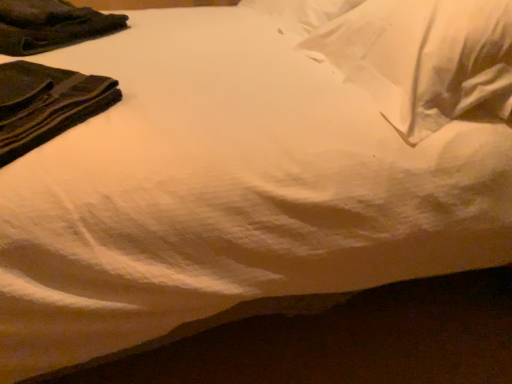
Identify the location of dark green fabric at upper left, the 1th clothing in the bottom-to-top sequence. (46, 104).

What do you see at coordinates (51, 25) in the screenshot? The height and width of the screenshot is (384, 512). I see `dark green fabric at upper left, the 1th clothing in the top-to-bottom sequence` at bounding box center [51, 25].

The width and height of the screenshot is (512, 384). Identify the location of white soft pillow at upper right. (425, 59).

Measure the distance between white soft pillow at upper right and camera.

36.93 inches.

This screenshot has width=512, height=384. Identify the location of dark green fabric at upper left, the 1th clothing in the bottom-to-top sequence. (46, 104).

From the picture: Is dark green fabric at upper left, the 2th clothing in the back-to-front sequence, smaller than dark green fabric at upper left, arranged as the second clothing when ordered from the bottom?

Indeed, dark green fabric at upper left, the 2th clothing in the back-to-front sequence, has a smaller size compared to dark green fabric at upper left, arranged as the second clothing when ordered from the bottom.

Does dark green fabric at upper left, the 1th clothing in the bottom-to-top sequence, have a greater width compared to dark green fabric at upper left, acting as the 2th clothing starting from the front?

In fact, dark green fabric at upper left, the 1th clothing in the bottom-to-top sequence, might be narrower than dark green fabric at upper left, acting as the 2th clothing starting from the front.

Between point (44, 127) and point (1, 46), which one is positioned behind?

The point (1, 46) is behind.

Is dark green fabric at upper left, the 2th clothing in the back-to-front sequence, positioned behind dark green fabric at upper left, acting as the 2th clothing starting from the front?

That is False.

Who is more distant, dark green fabric at upper left, the 1th clothing in the bottom-to-top sequence, or white soft pillow at upper right?

white soft pillow at upper right is further from the camera.

From a real-world perspective, relative to white soft pillow at upper right, is dark green fabric at upper left, the 2th clothing in the back-to-front sequence, vertically above or below?

dark green fabric at upper left, the 2th clothing in the back-to-front sequence, is situated lower than white soft pillow at upper right in the real world.

Considering the sizes of objects dark green fabric at upper left, the 2th clothing in the back-to-front sequence, and white soft pillow at upper right in the image provided, who is bigger, dark green fabric at upper left, the 2th clothing in the back-to-front sequence, or white soft pillow at upper right?

With larger size is white soft pillow at upper right.

Considering the sizes of objects dark green fabric at upper left, the 2th clothing in the back-to-front sequence, and white soft pillow at upper right in the image provided, who is thinner, dark green fabric at upper left, the 2th clothing in the back-to-front sequence, or white soft pillow at upper right?

dark green fabric at upper left, the 2th clothing in the back-to-front sequence.

Measure the distance between white soft pillow at upper right and dark green fabric at upper left, the 2th clothing in the back-to-front sequence.

white soft pillow at upper right is 29.86 inches away from dark green fabric at upper left, the 2th clothing in the back-to-front sequence.

From a real-world perspective, relative to dark green fabric at upper left, positioned as the first clothing in front-to-back order, is white soft pillow at upper right vertically above or below?

From a real-world perspective, white soft pillow at upper right is physically above dark green fabric at upper left, positioned as the first clothing in front-to-back order.

From the image's perspective, is white soft pillow at upper right located above or below dark green fabric at upper left, positioned as the 2th clothing in top-to-bottom order?

From the image's perspective, white soft pillow at upper right appears above dark green fabric at upper left, positioned as the 2th clothing in top-to-bottom order.

Is there a large distance between white soft pillow at upper right and dark green fabric at upper left, the 1th clothing in the bottom-to-top sequence?

No, white soft pillow at upper right is not far from dark green fabric at upper left, the 1th clothing in the bottom-to-top sequence.

Is white soft pillow at upper right a part of dark green fabric at upper left, the first clothing from the back?

That's incorrect, white soft pillow at upper right is not inside dark green fabric at upper left, the first clothing from the back.

Is dark green fabric at upper left, arranged as the second clothing when ordered from the bottom, in front of or behind white soft pillow at upper right in the image?

dark green fabric at upper left, arranged as the second clothing when ordered from the bottom, is behind white soft pillow at upper right.

Consider the image. Which of these two, dark green fabric at upper left, arranged as the second clothing when ordered from the bottom, or white soft pillow at upper right, is bigger?

white soft pillow at upper right.

I want to click on pillow in front of the dark green fabric at upper left, the 1th clothing in the top-to-bottom sequence, so click(x=425, y=59).

Is white soft pillow at upper right far away from dark green fabric at upper left, acting as the 2th clothing starting from the front?

white soft pillow at upper right is positioned a significant distance from dark green fabric at upper left, acting as the 2th clothing starting from the front.

Based on the photo, does white soft pillow at upper right have a lesser height compared to dark green fabric at upper left, the first clothing from the back?

Incorrect, the height of white soft pillow at upper right does not fall short of that of dark green fabric at upper left, the first clothing from the back.

Looking at this image, from the image's perspective, which one is positioned lower, white soft pillow at upper right or dark green fabric at upper left, the 1th clothing in the top-to-bottom sequence?

white soft pillow at upper right is shown below in the image.

Which object is positioned more to the right, dark green fabric at upper left, arranged as the second clothing when ordered from the bottom, or dark green fabric at upper left, the 2th clothing in the back-to-front sequence?

From the viewer's perspective, dark green fabric at upper left, the 2th clothing in the back-to-front sequence, appears more on the right side.

Is dark green fabric at upper left, acting as the 2th clothing starting from the front, positioned with its back to dark green fabric at upper left, positioned as the first clothing in front-to-back order?

No.

Is dark green fabric at upper left, arranged as the second clothing when ordered from the bottom, thinner than dark green fabric at upper left, positioned as the first clothing in front-to-back order?

Incorrect, the width of dark green fabric at upper left, arranged as the second clothing when ordered from the bottom, is not less than that of dark green fabric at upper left, positioned as the first clothing in front-to-back order.

Where is `clothing on the right side of dark green fabric at upper left, arranged as the second clothing when ordered from the bottom`? The image size is (512, 384). clothing on the right side of dark green fabric at upper left, arranged as the second clothing when ordered from the bottom is located at coordinates (46, 104).

The width and height of the screenshot is (512, 384). Find the location of `pillow behind the dark green fabric at upper left, the 2th clothing in the back-to-front sequence`. pillow behind the dark green fabric at upper left, the 2th clothing in the back-to-front sequence is located at coordinates (425, 59).

Which object lies nearer to the anchor point dark green fabric at upper left, arranged as the second clothing when ordered from the bottom, dark green fabric at upper left, the 2th clothing in the back-to-front sequence, or white soft pillow at upper right?

dark green fabric at upper left, the 2th clothing in the back-to-front sequence, is positioned closer to the anchor dark green fabric at upper left, arranged as the second clothing when ordered from the bottom.

From the image, which object appears to be nearer to dark green fabric at upper left, positioned as the 2th clothing in top-to-bottom order, white soft pillow at upper right or dark green fabric at upper left, the 1th clothing in the top-to-bottom sequence?

dark green fabric at upper left, the 1th clothing in the top-to-bottom sequence, is positioned closer to the anchor dark green fabric at upper left, positioned as the 2th clothing in top-to-bottom order.

Considering their positions, is dark green fabric at upper left, positioned as the 2th clothing in top-to-bottom order, positioned closer to white soft pillow at upper right than dark green fabric at upper left, the first clothing from the back?

dark green fabric at upper left, positioned as the 2th clothing in top-to-bottom order.

Looking at the image, which one is located closer to dark green fabric at upper left, acting as the 2th clothing starting from the front, white soft pillow at upper right or dark green fabric at upper left, the 2th clothing in the back-to-front sequence?

dark green fabric at upper left, the 2th clothing in the back-to-front sequence, is closer to dark green fabric at upper left, acting as the 2th clothing starting from the front.

Considering their positions, is dark green fabric at upper left, the first clothing from the back, positioned further to white soft pillow at upper right than dark green fabric at upper left, positioned as the first clothing in front-to-back order?

The object further to white soft pillow at upper right is dark green fabric at upper left, the first clothing from the back.

Based on their spatial positions, is dark green fabric at upper left, arranged as the second clothing when ordered from the bottom, or white soft pillow at upper right closer to dark green fabric at upper left, positioned as the first clothing in front-to-back order?

dark green fabric at upper left, arranged as the second clothing when ordered from the bottom, is positioned closer to the anchor dark green fabric at upper left, positioned as the first clothing in front-to-back order.

Locate an element on the screen. The width and height of the screenshot is (512, 384). clothing between dark green fabric at upper left, the first clothing from the back, and white soft pillow at upper right from left to right is located at coordinates (46, 104).